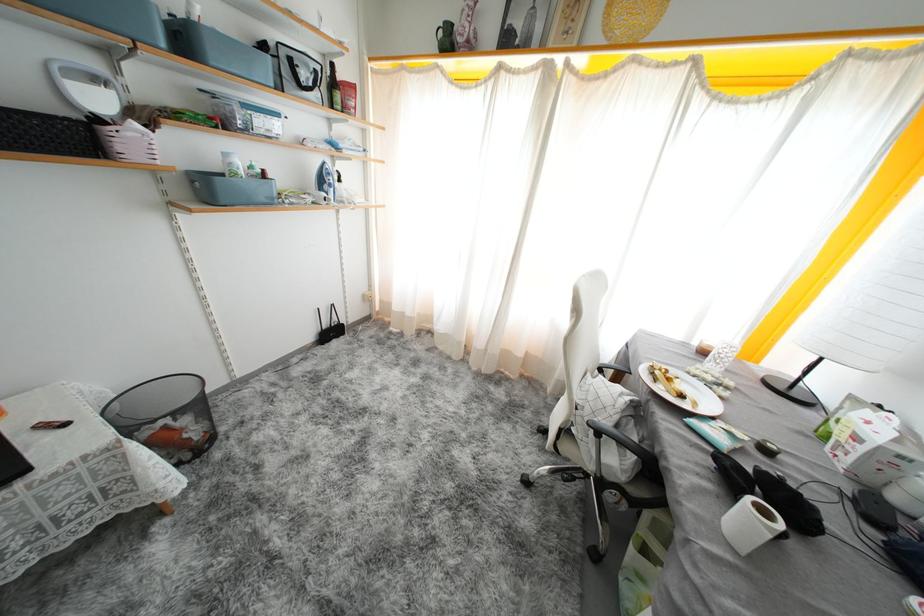
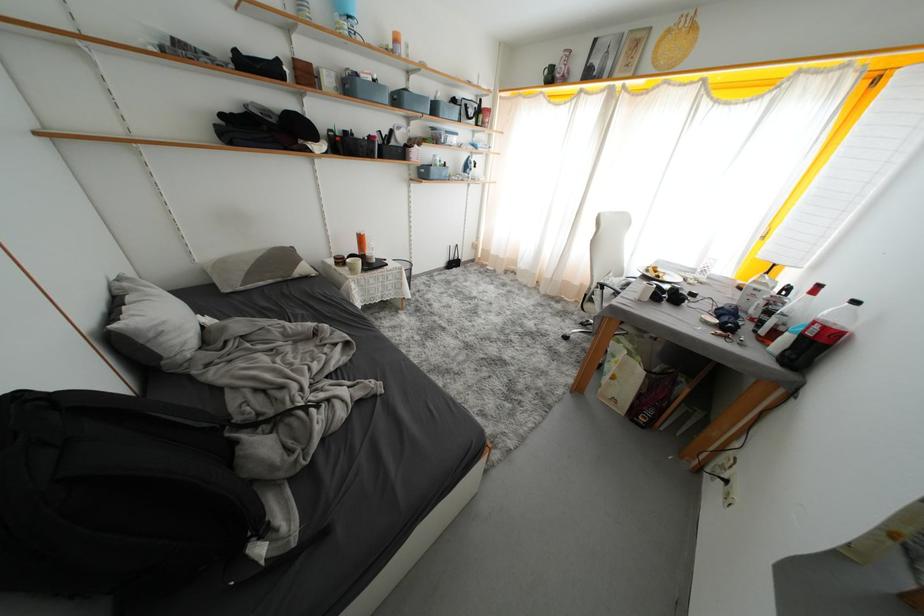
Locate, in the second image, the point that corresponds to point (215, 196) in the first image.

(431, 177)